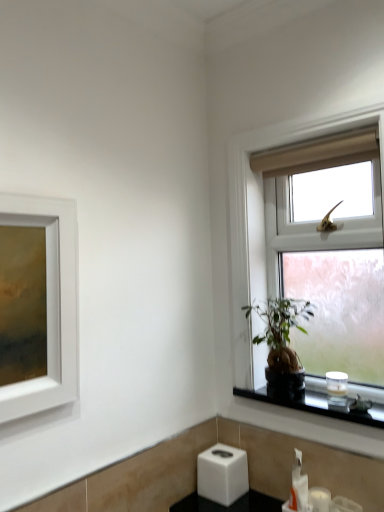
The width and height of the screenshot is (384, 512). I want to click on vacant point above black glass candle at right (from a real-world perspective), so click(x=320, y=392).